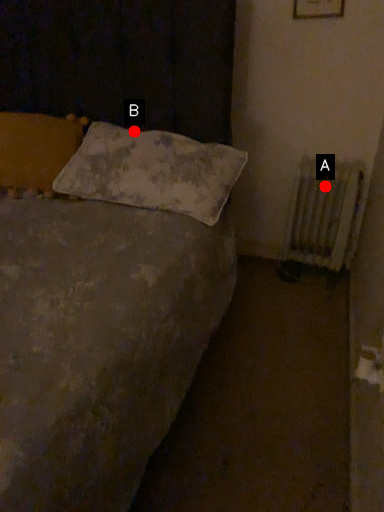
Question: Two points are circled on the image, labeled by A and B beside each circle. Which point is closer to the camera taking this photo?

Choices:
 (A) A is closer
 (B) B is closer

Answer: (B)